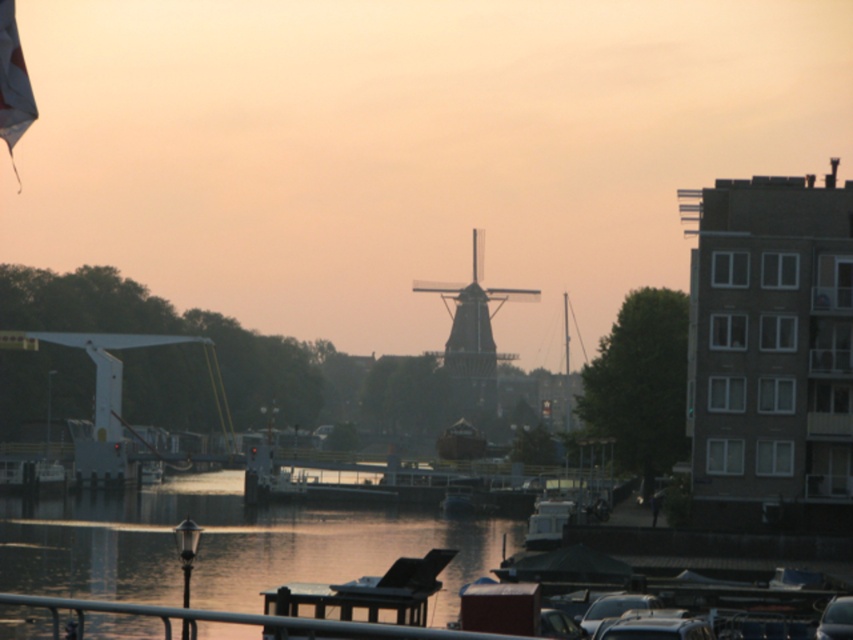
Question: Is silvery reflective water at center positioned behind wooden windmill at center?

Choices:
 (A) yes
 (B) no

Answer: (B)

Question: Which object appears farthest from the camera in this image?

Choices:
 (A) silvery reflective water at center
 (B) metallic gray rail at lower center
 (C) wooden windmill at center

Answer: (C)

Question: Which object is positioned farthest from the wooden windmill at center?

Choices:
 (A) silvery reflective water at center
 (B) metallic gray rail at lower center

Answer: (B)

Question: Which point is closer to the camera taking this photo?

Choices:
 (A) (18, 593)
 (B) (73, 604)
 (C) (444, 356)

Answer: (B)

Question: Is silvery reflective water at center wider than metallic gray rail at lower center?

Choices:
 (A) no
 (B) yes

Answer: (B)

Question: Where is silvery reflective water at center located in relation to metallic gray rail at lower center in the image?

Choices:
 (A) left
 (B) right

Answer: (A)